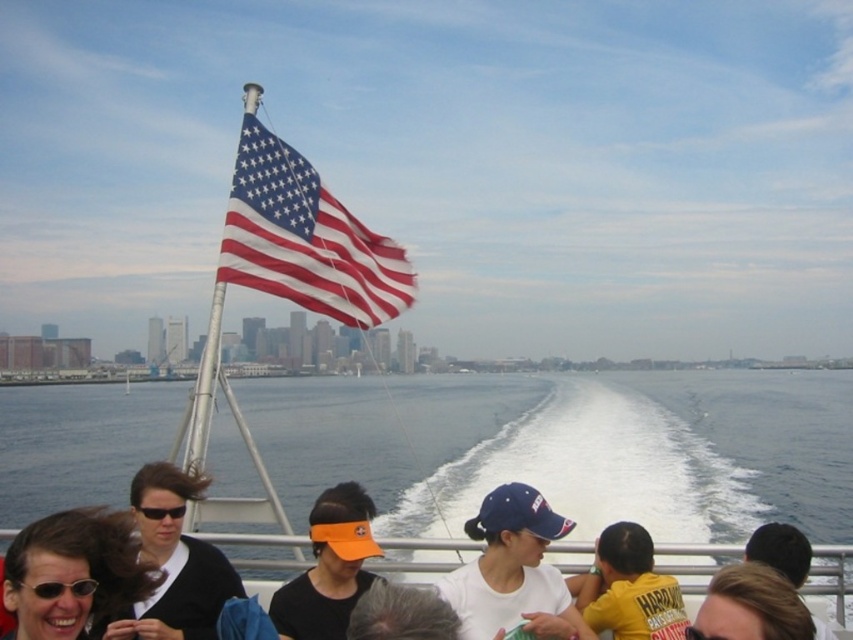
Identify the location of matte fabric flag at upper center. Image resolution: width=853 pixels, height=640 pixels. (305, 237).

Is matte fabric flag at upper center bigger than matte black sunglasses at lower left?

Yes.

Who is more distant from viewer, (253, 218) or (120, 516)?

Point (253, 218)

Where is `matte fabric flag at upper center`? matte fabric flag at upper center is located at coordinates (305, 237).

Does matte fabric flag at upper center have a greater height compared to blonde hair at lower right?

Correct, matte fabric flag at upper center is much taller as blonde hair at lower right.

Between matte fabric flag at upper center and blonde hair at lower right, which one is positioned lower?

Positioned lower is blonde hair at lower right.

The image size is (853, 640). What are the coordinates of `matte fabric flag at upper center` in the screenshot? It's located at (305, 237).

Between point (318, 573) and point (648, 608), which one is positioned behind?

Positioned behind is point (318, 573).

Is point (317, 602) closer to viewer compared to point (618, 616)?

That is False.

Who is more forward, (344, 632) or (636, 554)?

Point (344, 632) is in front.

This screenshot has width=853, height=640. In order to click on orange visor at center in this screenshot , I will do `click(329, 566)`.